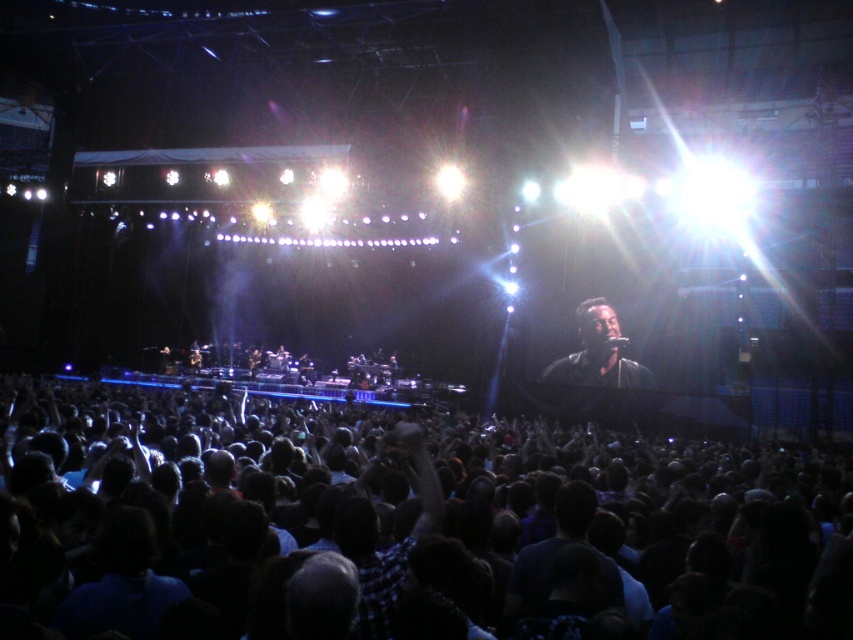
Between dark hair crowd at center and black matte microphone at center, which one has more height?

black matte microphone at center is taller.

Does dark hair crowd at center lie behind black matte microphone at center?

No, dark hair crowd at center is in front of black matte microphone at center.

Which is in front, point (456, 481) or point (596, 310)?

Positioned in front is point (456, 481).

Identify the location of dark hair crowd at center. Image resolution: width=853 pixels, height=640 pixels. (436, 529).